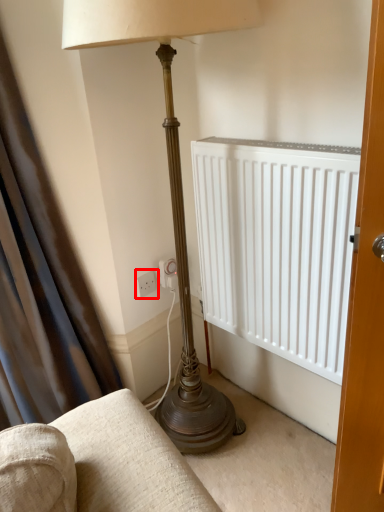
Question: From the image's perspective, considering the relative positions of electric outlet (annotated by the red box) and curtain in the image provided, where is electric outlet (annotated by the red box) located with respect to the staircase?

Choices:
 (A) below
 (B) above

Answer: (A)